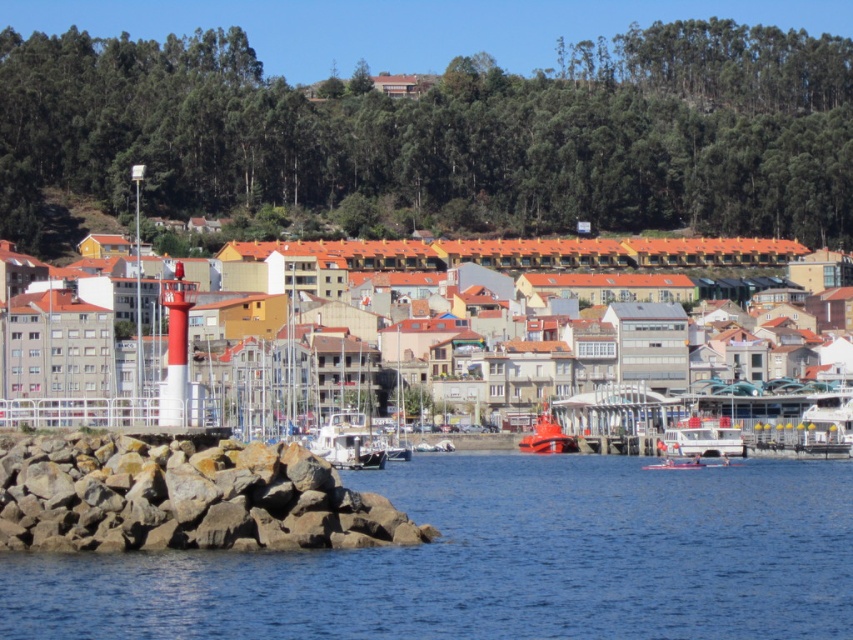
What is the color of the water at the point with coordinates (497, 561)?

The blue water at lower left is represented by point (497, 561).

You are a tourist standing on the jetty and want to take a photo of the white plastic boat at center and the blue water at lower left. Which object should you frame first in your camera to ensure both are in the shot?

You should frame the blue water at lower left first since it is to the left of the white plastic boat at center, allowing both to be captured in the shot.